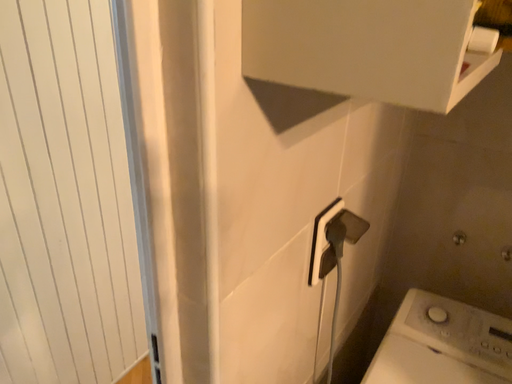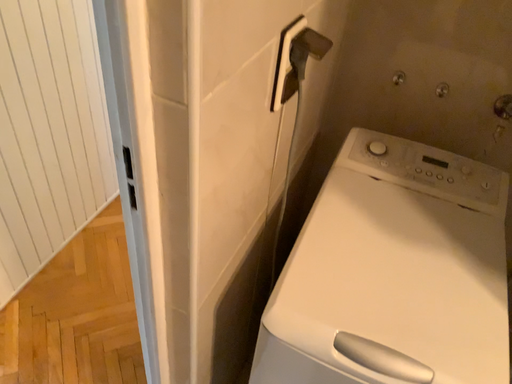
Question: Which way did the camera rotate in the video?

Choices:
 (A) rotated downward
 (B) rotated upward

Answer: (A)